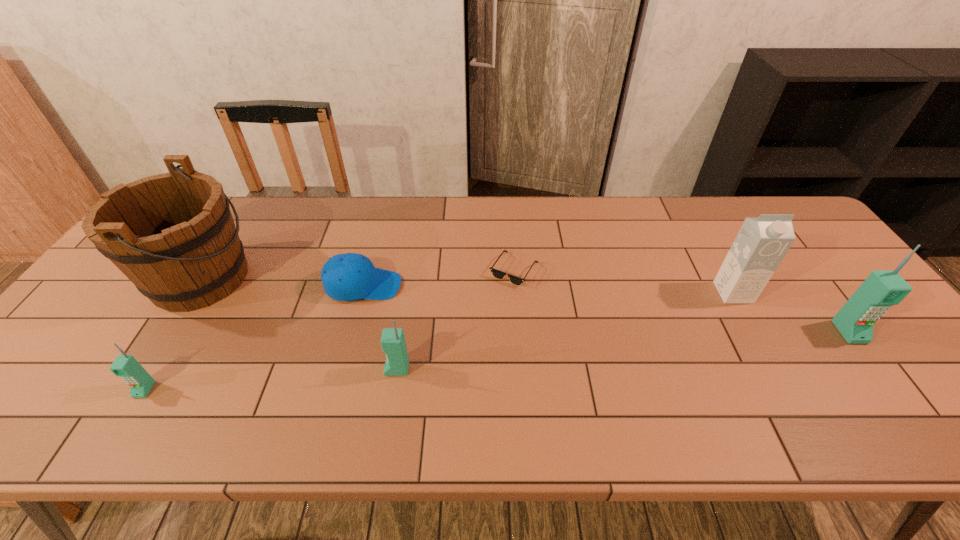
Point out which object is positioned as the fourth nearest to the cap. Please provide its 2D coordinates. Your answer should be formatted as a tuple, i.e. [(x, y)], where the tuple contains the x and y coordinates of a point satisfying the conditions above.

[(127, 367)]

Locate an element on the screen. The image size is (960, 540). cellular telephone that is the closest to the farthest cellular telephone is located at coordinates (393, 343).

This screenshot has width=960, height=540. Identify the location of cellular telephone that stands as the second closest to the second nearest object. (855, 320).

Identify the location of blank space that satisfies the following two spatial constraints: 1. on the front label of the carton; 2. on the keypad of the second nearest cellular telephone. (776, 369).

Locate an element on the screen. This screenshot has height=540, width=960. free space that satisfies the following two spatial constraints: 1. on the front label of the second object from right to left; 2. on the keypad of the second cellular telephone from left to right is located at coordinates (776, 369).

Where is `vacant position in the image that satisfies the following two spatial constraints: 1. on the front label of the carton; 2. on the keypad of the second nearest cellular telephone`? The height and width of the screenshot is (540, 960). vacant position in the image that satisfies the following two spatial constraints: 1. on the front label of the carton; 2. on the keypad of the second nearest cellular telephone is located at coordinates coord(776,369).